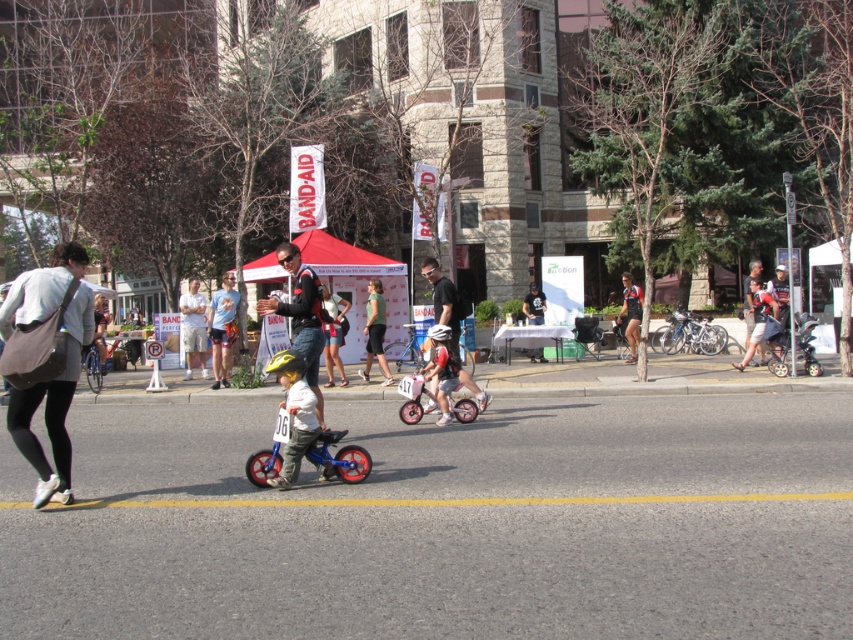
You are a photographer trying to capture a photo of the green matte shirt at center and the black matte shirt at center. Which one should you focus on first to ensure they are both in frame?

The green matte shirt at center is shorter than the black matte shirt at center, so you should focus on the green matte shirt at center first to ensure both are in frame.